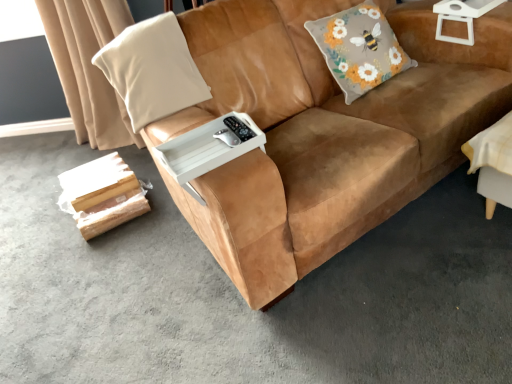
Question: Is suede brown couch at center at the right side of fluffy gray cushion with floral design at upper right, acting as the 1th throw pillow starting from the right?

Choices:
 (A) no
 (B) yes

Answer: (A)

Question: Is suede brown couch at center oriented towards fluffy gray cushion with floral design at upper right, which ranks as the 2th throw pillow in left-to-right order?

Choices:
 (A) no
 (B) yes

Answer: (B)

Question: Is suede brown couch at center bigger than fluffy gray cushion with floral design at upper right, acting as the 1th throw pillow starting from the right?

Choices:
 (A) yes
 (B) no

Answer: (A)

Question: From a real-world perspective, is suede brown couch at center beneath fluffy gray cushion with floral design at upper right, acting as the 1th throw pillow starting from the right?

Choices:
 (A) yes
 (B) no

Answer: (A)

Question: Is suede brown couch at center turned away from fluffy gray cushion with floral design at upper right, acting as the 1th throw pillow starting from the right?

Choices:
 (A) yes
 (B) no

Answer: (A)

Question: Does point (165, 51) appear closer or farther from the camera than point (423, 62)?

Choices:
 (A) closer
 (B) farther

Answer: (A)

Question: Would you say beige fabric pillow at left, the second throw pillow when ordered from right to left, is to the left or to the right of suede brown couch at center in the picture?

Choices:
 (A) left
 (B) right

Answer: (A)

Question: From the image's perspective, is beige fabric pillow at left, arranged as the first throw pillow when viewed from the left, positioned above or below suede brown couch at center?

Choices:
 (A) above
 (B) below

Answer: (A)

Question: Which is correct: beige fabric pillow at left, arranged as the first throw pillow when viewed from the left, is inside suede brown couch at center, or outside of it?

Choices:
 (A) inside
 (B) outside

Answer: (A)

Question: Considering their positions, is fluffy gray cushion with floral design at upper right, acting as the 1th throw pillow starting from the right, located in front of or behind beige fabric pillow at left, the second throw pillow when ordered from right to left?

Choices:
 (A) behind
 (B) front

Answer: (A)

Question: From the image's perspective, relative to beige fabric pillow at left, the second throw pillow when ordered from right to left, is fluffy gray cushion with floral design at upper right, acting as the 1th throw pillow starting from the right, above or below?

Choices:
 (A) above
 (B) below

Answer: (A)

Question: Considering the positions of fluffy gray cushion with floral design at upper right, which ranks as the 2th throw pillow in left-to-right order, and beige fabric pillow at left, arranged as the first throw pillow when viewed from the left, in the image, is fluffy gray cushion with floral design at upper right, which ranks as the 2th throw pillow in left-to-right order, taller or shorter than beige fabric pillow at left, arranged as the first throw pillow when viewed from the left,?

Choices:
 (A) short
 (B) tall

Answer: (B)

Question: From a real-world perspective, is fluffy gray cushion with floral design at upper right, acting as the 1th throw pillow starting from the right, positioned above or below beige fabric pillow at left, the second throw pillow when ordered from right to left?

Choices:
 (A) below
 (B) above

Answer: (A)

Question: Is beige fabric pillow at left, the second throw pillow when ordered from right to left, situated inside white plastic side table at upper right or outside?

Choices:
 (A) inside
 (B) outside

Answer: (B)

Question: From a real-world perspective, relative to white plastic side table at upper right, is beige fabric pillow at left, arranged as the first throw pillow when viewed from the left, vertically above or below?

Choices:
 (A) below
 (B) above

Answer: (B)